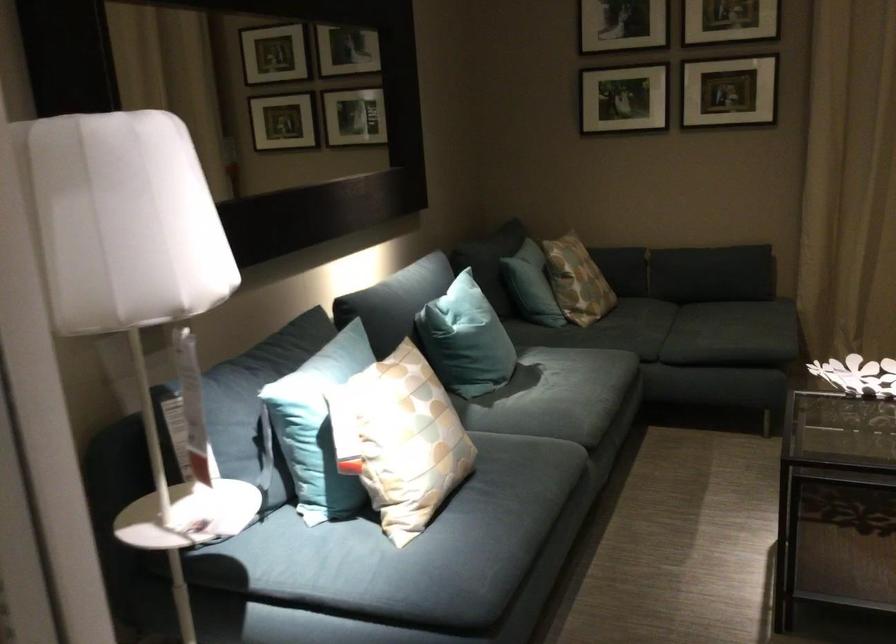
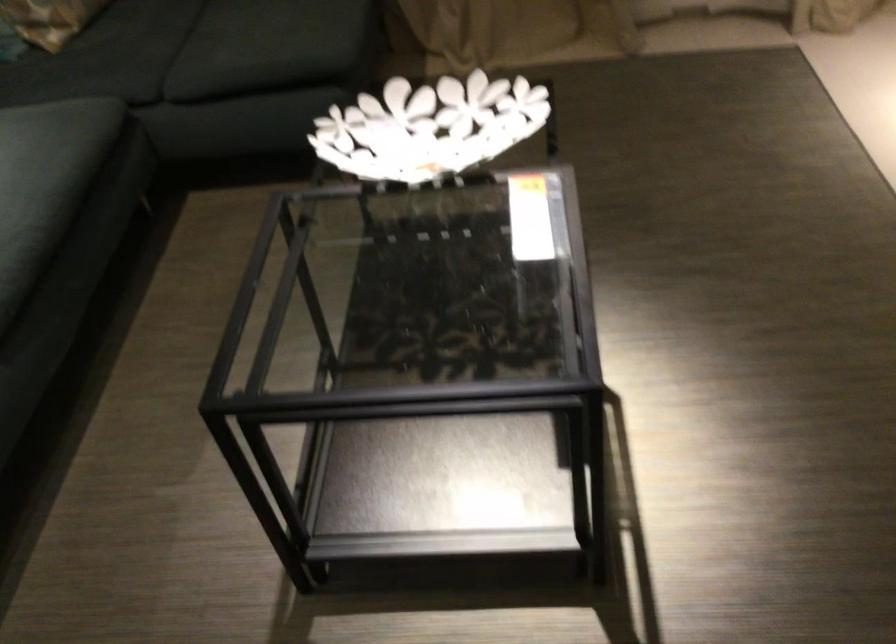
Where in the second image is the point corresponding to (616,328) from the first image?

(85, 73)